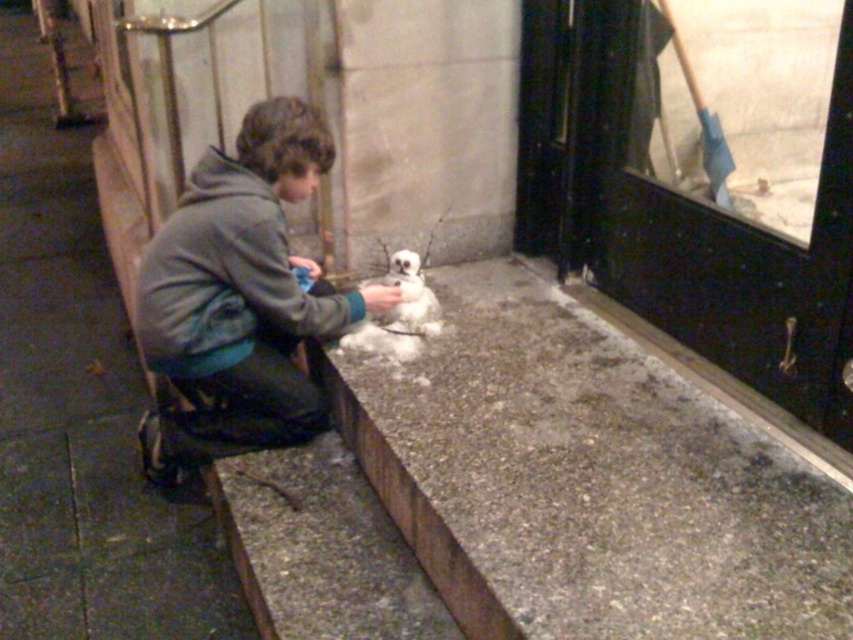
Question: Is granite ledge at lower center to the right of green fleece jacket at center from the viewer's perspective?

Choices:
 (A) no
 (B) yes

Answer: (B)

Question: Does granite ledge at lower center have a lesser width compared to green fleece jacket at center?

Choices:
 (A) yes
 (B) no

Answer: (B)

Question: Which point is farther to the camera?

Choices:
 (A) green fleece jacket at center
 (B) granite ledge at lower center

Answer: (A)

Question: Which of the following is the closest to the observer?

Choices:
 (A) granite ledge at lower center
 (B) green fleece jacket at center

Answer: (A)

Question: Is granite ledge at lower center further to camera compared to green fleece jacket at center?

Choices:
 (A) yes
 (B) no

Answer: (B)

Question: Among these points, which one is nearest to the camera?

Choices:
 (A) (450, 364)
 (B) (190, 202)

Answer: (B)